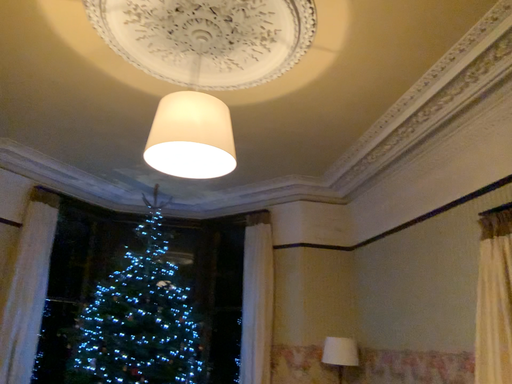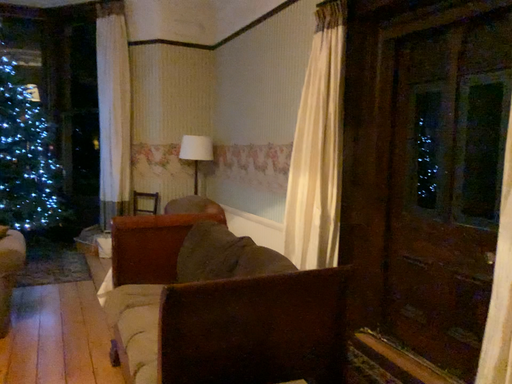
Question: Which way did the camera rotate in the video?

Choices:
 (A) rotated upward
 (B) rotated downward

Answer: (B)